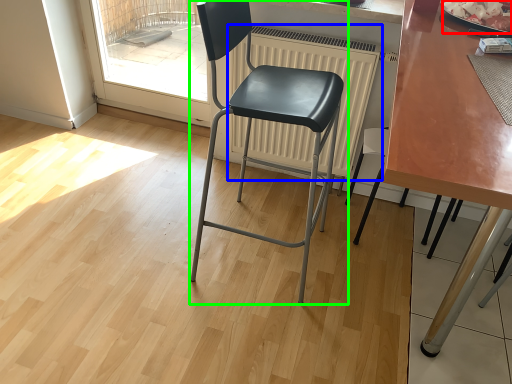
Question: Estimate the real-world distances between objects in this image. Which object is closer to food (highlighted by a red box), radiator (highlighted by a blue box) or chair (highlighted by a green box)?

Choices:
 (A) radiator
 (B) chair

Answer: (A)